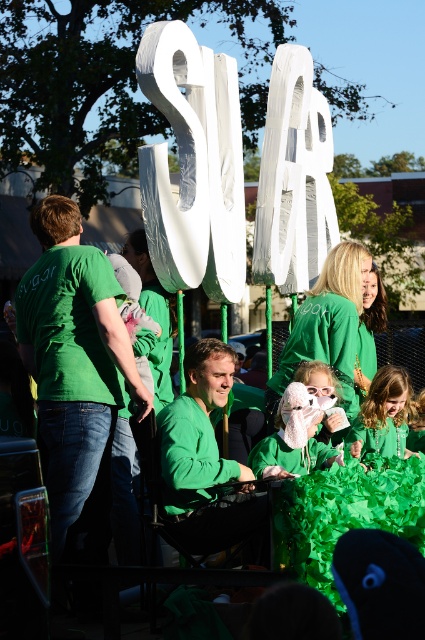
You are a photographer trying to capture a closeup of the white plush toy at center. You notice the matte green sweater at center is blocking part of the toy. Can you estimate whether the sweater is wider than the toy, making it harder to frame the shot?

The matte green sweater at center is wider than the white plush toy at center, so it is blocking more of the toy, making it harder to frame the shot.

You are a photographer trying to capture a wide shot of the float. The green cotton shirt at left and the white fluffy hat at center are both in your frame. Which object should you adjust your focus on if you want to prioritize capturing the wider object?

The green cotton shirt at left is wider than the white fluffy hat at center, so you should focus on the green cotton shirt at left to prioritize capturing the wider object.